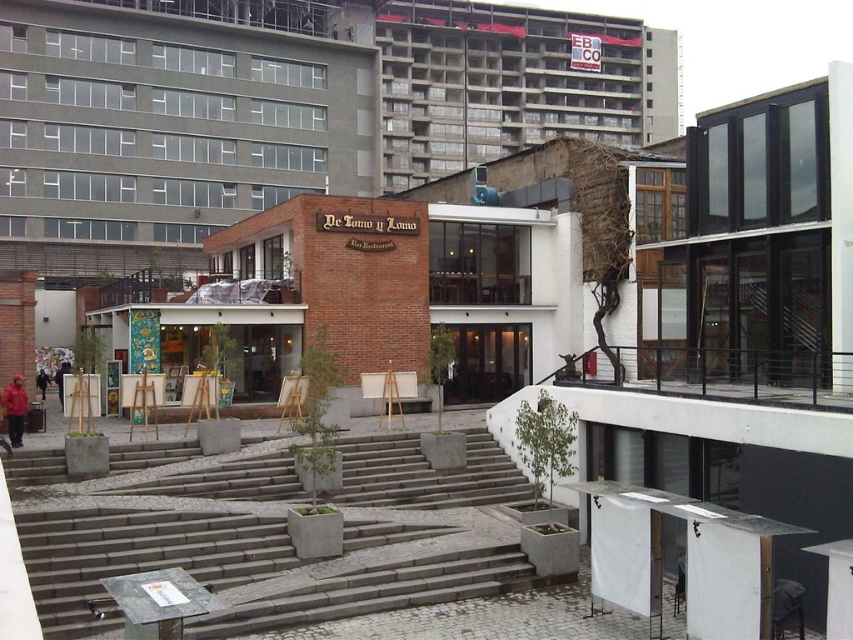
Looking at this image, you are an artist carrying a large canvas that is 1 meter wide. You need to set up your wooden easel at center in the plaza. However, there are gray concrete stairs at center nearby. Will the stairs block the space needed for your easel?

The gray concrete stairs at center might be wider than wooden easel at center, so there is a possibility that the stairs could block the space needed for the easel. You should check the exact dimensions to ensure there is enough room.